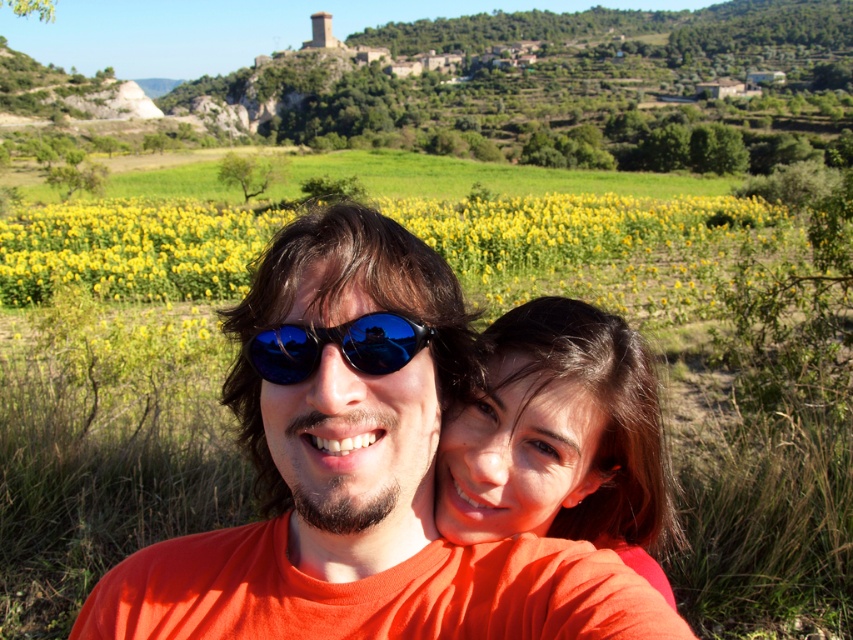
Between smooth brown hair at center and blue reflective sunglasses at center, which one is positioned higher?

blue reflective sunglasses at center is above.

Who is positioned more to the left, smooth brown hair at center or blue reflective sunglasses at center?

From the viewer's perspective, blue reflective sunglasses at center appears more on the left side.

This screenshot has width=853, height=640. I want to click on smooth brown hair at center, so click(560, 438).

Find the location of `smooth brown hair at center`. smooth brown hair at center is located at coordinates 560,438.

Which of these two, smooth brown hair at center or yellow matte sunflower at center, stands shorter?

smooth brown hair at center

Who is positioned more to the right, smooth brown hair at center or yellow matte sunflower at center?

Positioned to the right is smooth brown hair at center.

Which is in front, point (508, 513) or point (143, 300)?

Point (508, 513) is more forward.

The image size is (853, 640). Find the location of `smooth brown hair at center`. smooth brown hair at center is located at coordinates click(560, 438).

Which is in front, point (280, 307) or point (541, 378)?

Point (280, 307) is in front.

Can you confirm if matte orange t-shirt at center is positioned above smooth brown hair at center?

Yes.

Does point (515, 547) lie behind point (523, 396)?

No, (515, 547) is in front of (523, 396).

Where is `matte orange t-shirt at center`? This screenshot has height=640, width=853. matte orange t-shirt at center is located at coordinates (358, 474).